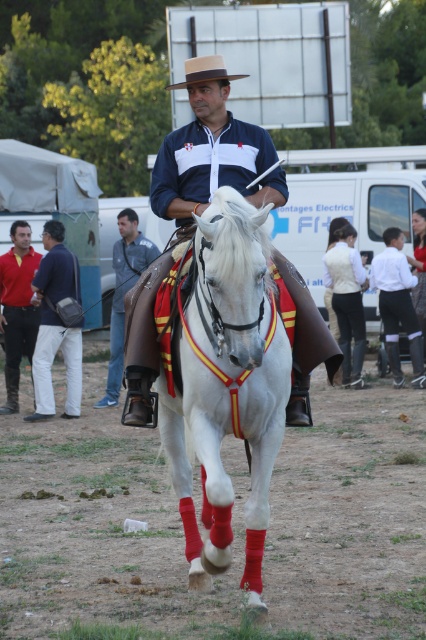
Question: Which object is positioned farthest from the dirt field at center?

Choices:
 (A) natural straw cowboy hat at center
 (B) matte white shirt at center
 (C) white glossy horse at center
 (D) leather saddle at center

Answer: (B)

Question: Is dirt field at center below white glossy horse at center?

Choices:
 (A) yes
 (B) no

Answer: (A)

Question: From the image, what is the correct spatial relationship of dirt field at center in relation to white glossy horse at center?

Choices:
 (A) below
 (B) above

Answer: (A)

Question: Among these objects, which one is nearest to the camera?

Choices:
 (A) matte white shirt at center
 (B) red shirt at left
 (C) natural straw cowboy hat at center
 (D) matte gray bag at lower left

Answer: (A)

Question: Is matte white shirt at center positioned before leather saddle at center?

Choices:
 (A) no
 (B) yes

Answer: (B)

Question: Which is farther from the red shirt at left?

Choices:
 (A) leather saddle at center
 (B) dirt field at center
 (C) white glossy horse at center

Answer: (C)